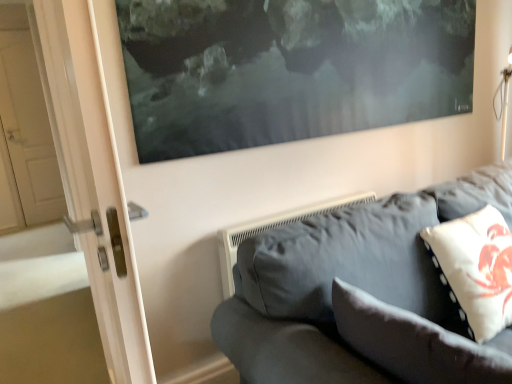
Question: In terms of width, does white fabric pillow at lower right, which ranks as the 2th pillow in right-to-left order, look wider or thinner when compared to white dotted fabric pillow at right, marked as the 2th pillow in a left-to-right arrangement?

Choices:
 (A) wide
 (B) thin

Answer: (B)

Question: Considering the positions of point (352, 339) and point (465, 281), is point (352, 339) closer or farther from the camera than point (465, 281)?

Choices:
 (A) farther
 (B) closer

Answer: (B)

Question: Estimate the real-world distances between objects in this image. Which object is farther from the white dotted fabric pillow at right, the 1th pillow in the right-to-left sequence?

Choices:
 (A) dark gray fabric couch at lower right
 (B) white fabric pillow at lower right, marked as the first pillow in a left-to-right arrangement

Answer: (B)

Question: Estimate the real-world distances between objects in this image. Which object is farther from the dark gray fabric couch at lower right?

Choices:
 (A) white dotted fabric pillow at right, marked as the 2th pillow in a left-to-right arrangement
 (B) white fabric pillow at lower right, which ranks as the 2th pillow in right-to-left order

Answer: (A)